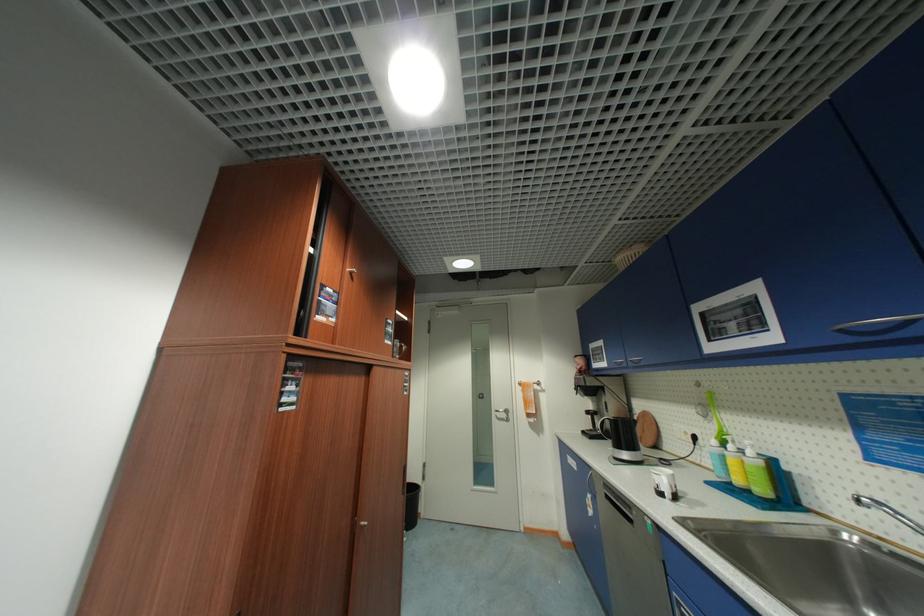
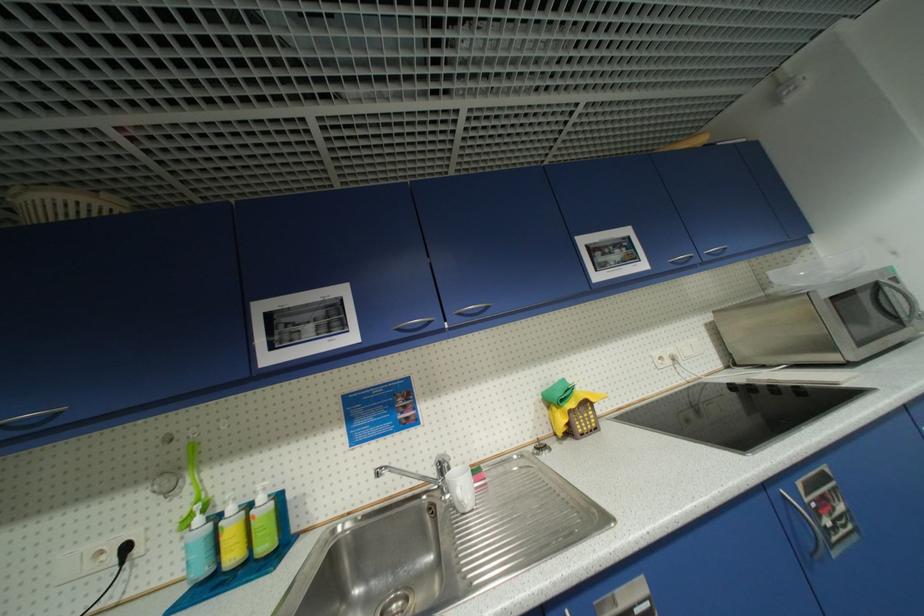
In the second image, find the point that corresponds to [726,432] in the first image.

(203, 501)